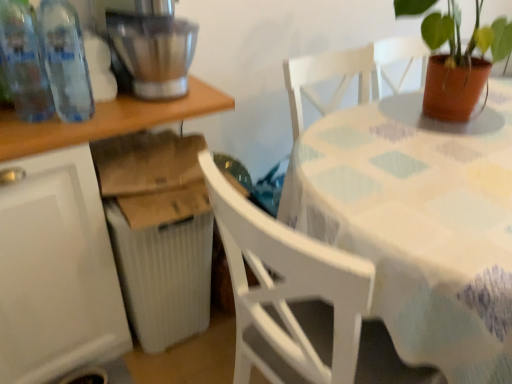
Question: Should I look upward or downward to see brushed metal mixer at upper left?

Choices:
 (A) down
 (B) up

Answer: (B)

Question: Is white plastic table at lower left, positioned as the second table in right-to-left order, outside transparent plastic bottles at left, which is counted as the first bottle, starting from the right?

Choices:
 (A) yes
 (B) no

Answer: (A)

Question: Would you consider white plastic table at lower left, positioned as the second table in right-to-left order, to be distant from transparent plastic bottles at left, the second bottle positioned from the left?

Choices:
 (A) yes
 (B) no

Answer: (B)

Question: Does white plastic table at lower left, positioned as the second table in right-to-left order, turn towards transparent plastic bottles at left, the second bottle positioned from the left?

Choices:
 (A) yes
 (B) no

Answer: (B)

Question: Considering the relative sizes of white plastic table at lower left, positioned as the second table in right-to-left order, and transparent plastic bottles at left, which is counted as the first bottle, starting from the right, in the image provided, is white plastic table at lower left, positioned as the second table in right-to-left order, wider than transparent plastic bottles at left, which is counted as the first bottle, starting from the right,?

Choices:
 (A) yes
 (B) no

Answer: (A)

Question: Is white plastic table at lower left, placed as the first table when sorted from left to right, closer to the viewer compared to transparent plastic bottles at left, which is counted as the first bottle, starting from the right?

Choices:
 (A) yes
 (B) no

Answer: (A)

Question: Does white plastic table at lower left, placed as the first table when sorted from left to right, have a larger size compared to transparent plastic bottles at left, the second bottle positioned from the left?

Choices:
 (A) no
 (B) yes

Answer: (B)

Question: From a real-world perspective, is transparent plastic bottles at left, placed as the 1th bottle when sorted from left to right, below transparent plastic bottles at left, which is counted as the first bottle, starting from the right?

Choices:
 (A) yes
 (B) no

Answer: (B)

Question: From the image's perspective, does transparent plastic bottles at left, placed as the second bottle when sorted from right to left, appear lower than transparent plastic bottles at left, which is counted as the first bottle, starting from the right?

Choices:
 (A) no
 (B) yes

Answer: (B)

Question: Is transparent plastic bottles at left, placed as the 1th bottle when sorted from left to right, oriented away from transparent plastic bottles at left, which is counted as the first bottle, starting from the right?

Choices:
 (A) no
 (B) yes

Answer: (A)

Question: Is transparent plastic bottles at left, placed as the 1th bottle when sorted from left to right, smaller than transparent plastic bottles at left, the second bottle positioned from the left?

Choices:
 (A) yes
 (B) no

Answer: (A)

Question: Does transparent plastic bottles at left, placed as the second bottle when sorted from right to left, have a lesser height compared to transparent plastic bottles at left, which is counted as the first bottle, starting from the right?

Choices:
 (A) no
 (B) yes

Answer: (A)

Question: Would you say transparent plastic bottles at left, placed as the second bottle when sorted from right to left, contains transparent plastic bottles at left, which is counted as the first bottle, starting from the right?

Choices:
 (A) yes
 (B) no

Answer: (B)

Question: From a real-world perspective, is white fabric-covered table at center, the second table when ordered from left to right, below transparent plastic bottles at left, the second bottle positioned from the left?

Choices:
 (A) yes
 (B) no

Answer: (A)